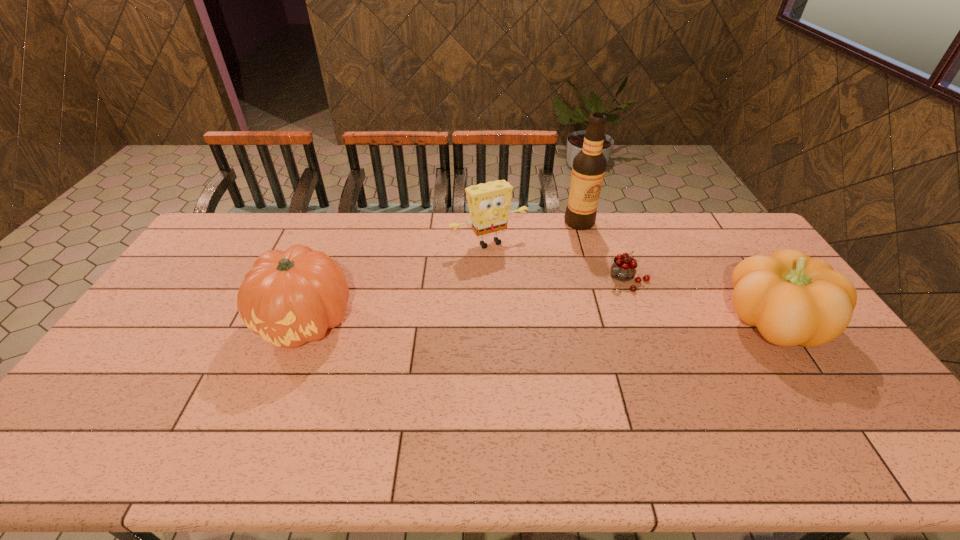
This screenshot has height=540, width=960. I want to click on the leftmost object, so click(x=291, y=297).

Identify the location of the right pumpkin. pos(793,299).

You are a GUI agent. You are given a task and a screenshot of the screen. Output one action in this format:
    pyautogui.click(x=<x>, y=<y>)
    Task: Click on the fourth object from right to left
    The image size is (960, 540).
    Given the screenshot: What is the action you would take?
    pyautogui.click(x=489, y=204)

The width and height of the screenshot is (960, 540). Find the location of `the shortest object`. the shortest object is located at coordinates click(x=624, y=267).

Identify the location of the tallest object. The width and height of the screenshot is (960, 540). (589, 165).

Where is `free region located on the carved face of the left pumpkin`? free region located on the carved face of the left pumpkin is located at coordinates (285, 378).

This screenshot has height=540, width=960. Identify the location of free spot located on the left of the right pumpkin. (628, 322).

Image resolution: width=960 pixels, height=540 pixels. I want to click on free spot located 0.090m on the face of the fourth object from right to left, so click(516, 268).

The width and height of the screenshot is (960, 540). What are the coordinates of `free location located on the face of the fourth object from right to left` in the screenshot? It's located at (563, 332).

You are a GUI agent. You are given a task and a screenshot of the screen. Output one action in this format:
    pyautogui.click(x=<x>, y=<y>)
    Task: Click on the free space located 0.250m on the face of the fourth object from right to left
    
    Given the screenshot: What is the action you would take?
    pyautogui.click(x=539, y=299)